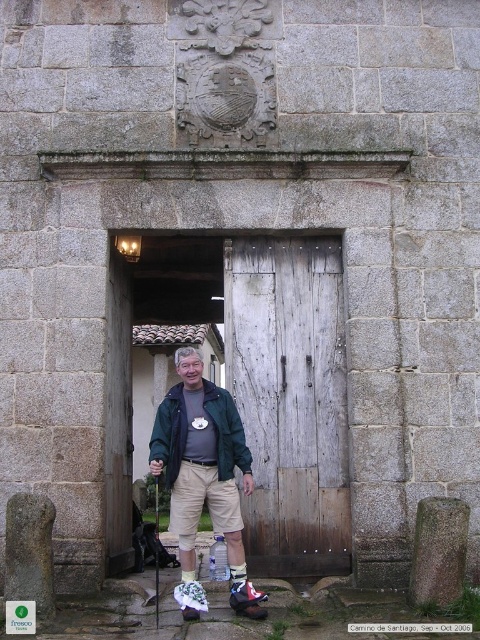
Question: Which of the following is the farthest from the observer?

Choices:
 (A) green fabric jacket at center
 (B) weathered wood door at center

Answer: (B)

Question: Which of the following is the closest to the observer?

Choices:
 (A) weathered wood door at center
 (B) green fabric jacket at center

Answer: (B)

Question: In this image, where is weathered wood door at center located relative to green fabric jacket at center?

Choices:
 (A) left
 (B) right

Answer: (B)

Question: Does weathered wood door at center appear on the right side of green fabric jacket at center?

Choices:
 (A) yes
 (B) no

Answer: (A)

Question: Is weathered wood door at center to the right of green fabric jacket at center from the viewer's perspective?

Choices:
 (A) no
 (B) yes

Answer: (B)